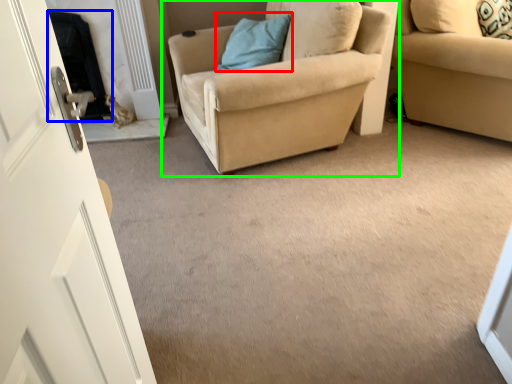
Question: Which object is the closest to the pillow (highlighted by a red box)? Choose among these: fireplace (highlighted by a blue box) or chair (highlighted by a green box).

Choices:
 (A) fireplace
 (B) chair

Answer: (B)